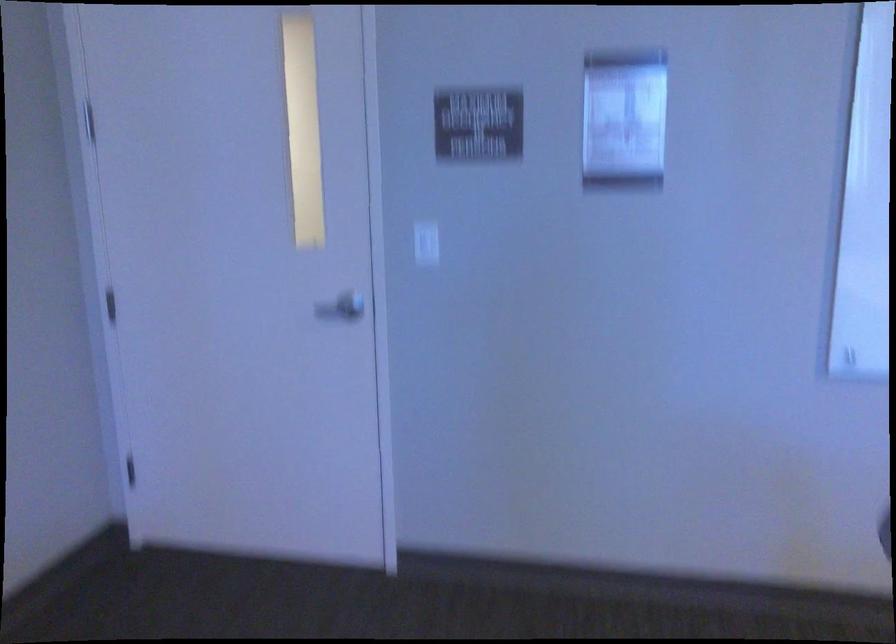
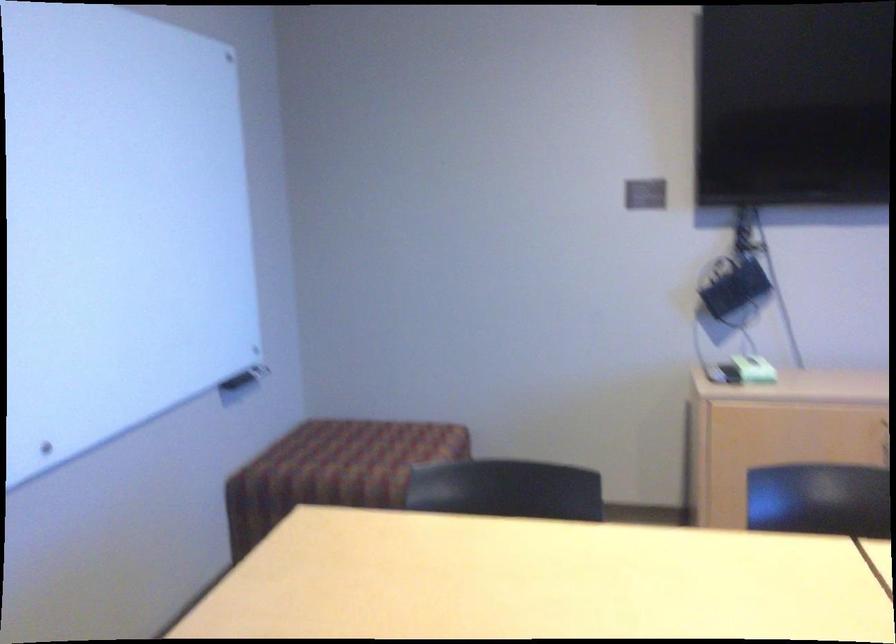
Question: Based on the continuous images, in which direction is the camera rotating? Reply with the corresponding letter.

Choices:
 (A) Left
 (B) Right
 (C) Up
 (D) Down

Answer: (B)